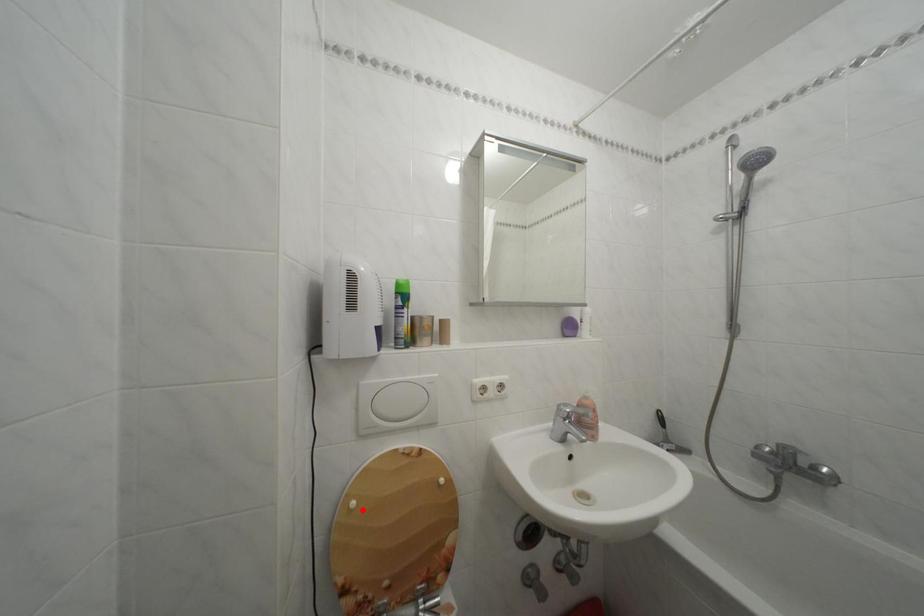
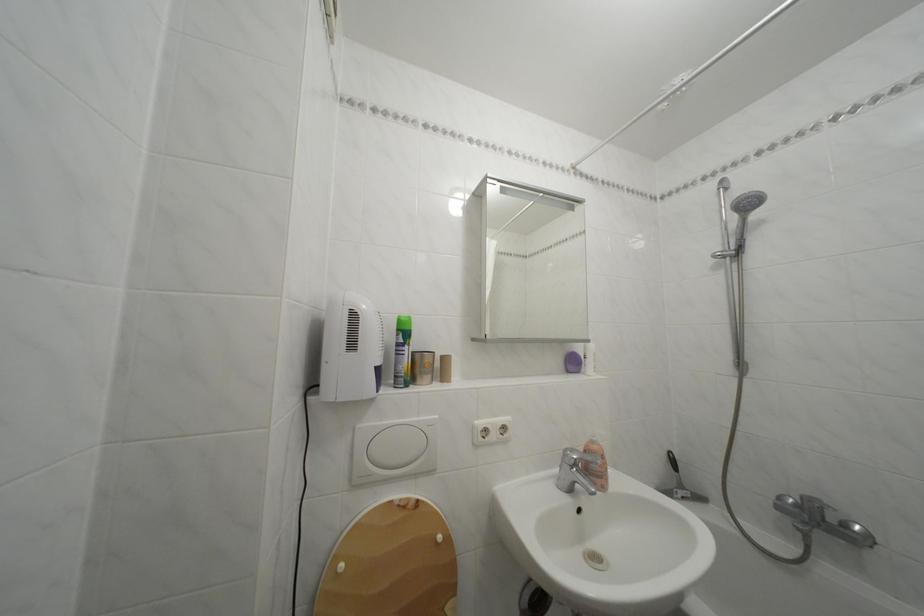
Where in the second image is the point corresponding to the highlighted location from the first image?

(350, 573)